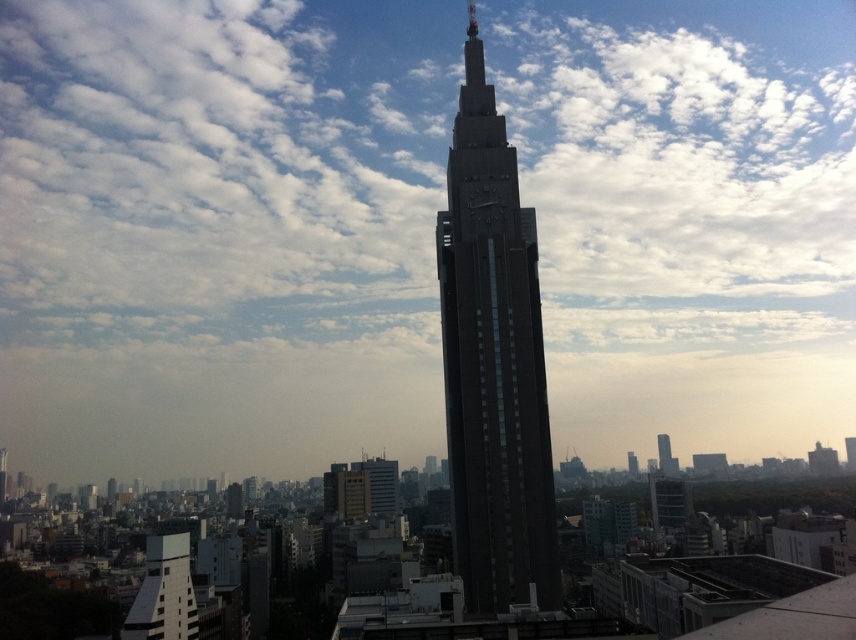
You are an architect analyzing the cityscape. You need to determine which structure has a greater horizontal span. Based on the scene, which one is wider between the dark brown glass tower at center and the white textured building at lower left?

The dark brown glass tower at center has a greater width than the white textured building at lower left according to the description.

You are a drone operator tasked with capturing aerial footage of the dark brown glass tower at center. Your drone is currently at coordinates point A, which is at the bottom left corner of the image. To ensure optimal framing, you need to position the drone directly above the tower. Given the tower is located at point 0.567, 0.577, what direction should you adjust the drone to move from its current position?

The dark brown glass tower at center is located at point (492, 362). Since the drone is at the bottom left corner, it needs to move northeast to reach the tower.

You are a city planner assessing the skyline. You need to determine which of the two buildings, the dark brown glass tower at center or the white textured building at lower left, would cast a longer shadow during midday. Based on their sizes and positions, which one would cast a longer shadow?

The dark brown glass tower at center is larger in size than the white textured building at lower left, so it would cast a longer shadow during midday.